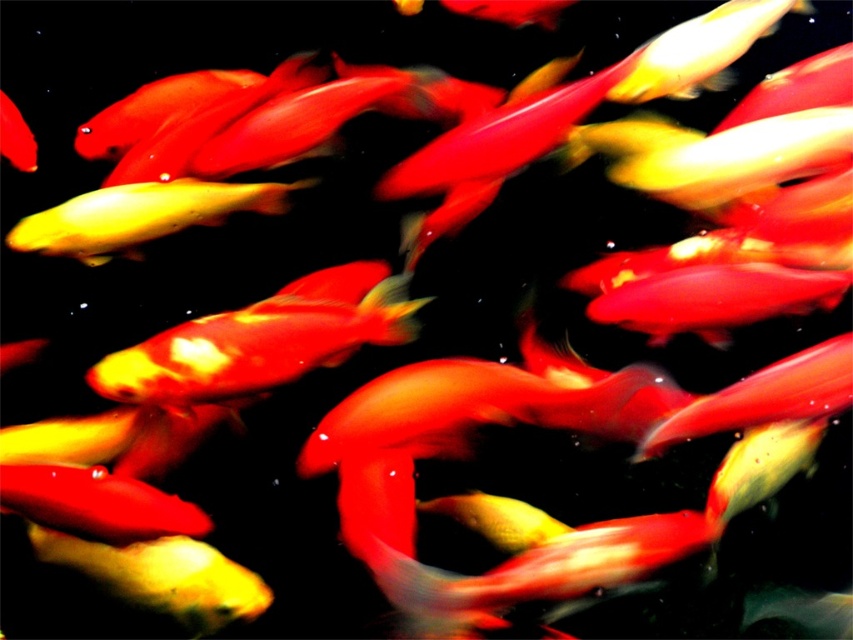
Question: Which of the following is the farthest from the observer?

Choices:
 (A) (3, 124)
 (B) (339, 360)
 (C) (113, 188)

Answer: (A)

Question: Does yellow glossy fish at left appear over shiny red fish at center?

Choices:
 (A) no
 (B) yes

Answer: (A)

Question: Can you confirm if shiny goldfish at center is positioned to the right of shiny red fish at center?

Choices:
 (A) no
 (B) yes

Answer: (B)

Question: Which of the following is the farthest from the observer?

Choices:
 (A) (120, 236)
 (B) (27, 154)
 (C) (354, 324)

Answer: (B)

Question: Which of the following is the farthest from the observer?

Choices:
 (A) yellow glossy fish at left
 (B) shiny goldfish at center
 (C) shiny red fish at center

Answer: (C)

Question: Does shiny goldfish at center have a smaller size compared to shiny red fish at center?

Choices:
 (A) no
 (B) yes

Answer: (A)